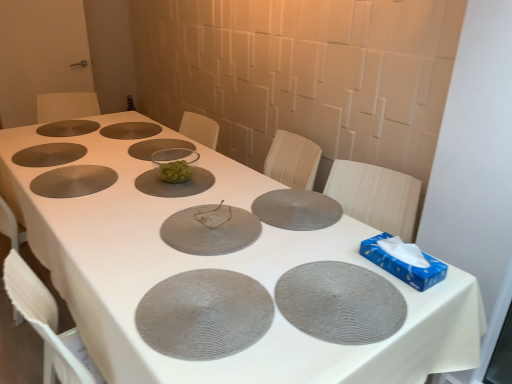
Locate an element on the screen. The image size is (512, 384). vacant area situated below matte gray placemat at center, which ranks as the 4th glass plate in front-to-back order (from a real-world perspective) is located at coordinates (290, 205).